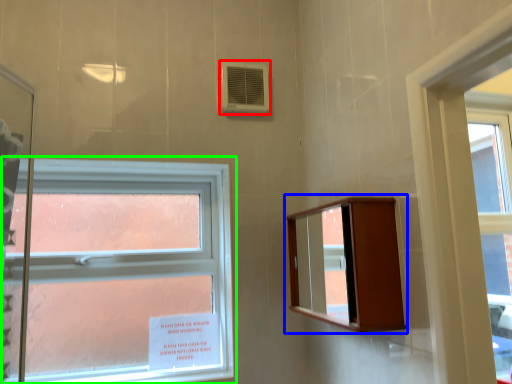
Question: Considering the real-world distances, which object is farthest from air conditioning (highlighted by a red box)? medicine cabinet (highlighted by a blue box) or window (highlighted by a green box)?

Choices:
 (A) medicine cabinet
 (B) window

Answer: (A)